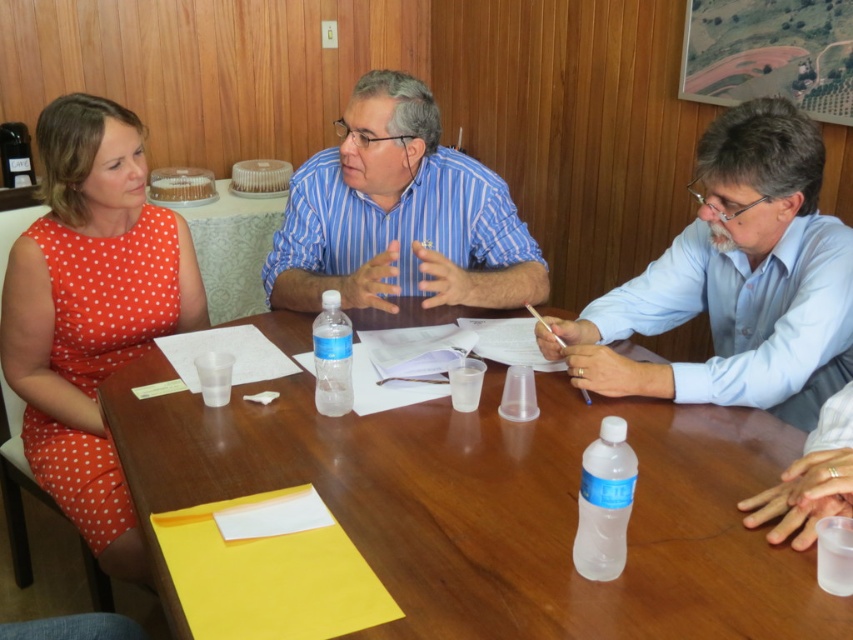
Can you confirm if wooden table at center is positioned below clear plastic bottle at center?

No, wooden table at center is not below clear plastic bottle at center.

Does wooden table at center come in front of clear plastic bottle at center?

Yes.

You are a GUI agent. You are given a task and a screenshot of the screen. Output one action in this format:
    pyautogui.click(x=<x>, y=<y>)
    Task: Click on the wooden table at center
    This screenshot has width=853, height=640.
    Given the screenshot: What is the action you would take?
    pyautogui.click(x=492, y=506)

How far apart are wooden table at center and clear plastic water bottle at center?

wooden table at center and clear plastic water bottle at center are 12.11 inches apart.

Can you confirm if wooden table at center is wider than clear plastic water bottle at center?

Yes, wooden table at center is wider than clear plastic water bottle at center.

I want to click on wooden table at center, so click(492, 506).

Find the location of a particular element. blue smooth shirt at right is located at coordinates (737, 280).

Is blue smooth shirt at right wider than blue striped shirt at center?

No, blue smooth shirt at right is not wider than blue striped shirt at center.

Is point (804, 152) behind point (428, 134)?

No.

At what (x,y) coordinates should I click in order to perform the action: click on blue smooth shirt at right. Please return your answer as a coordinate pair (x, y). This screenshot has width=853, height=640. Looking at the image, I should click on (737, 280).